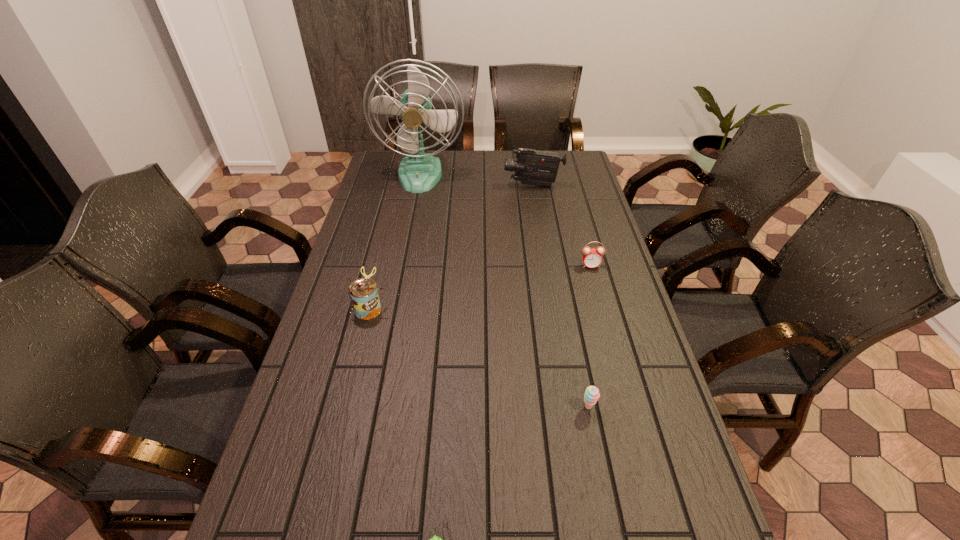
Find the location of a particular element. This screenshot has width=960, height=540. vacant space that satisfies the following two spatial constraints: 1. on the front-facing side of the camcorder; 2. on the right side of the fifth farthest object is located at coordinates (569, 407).